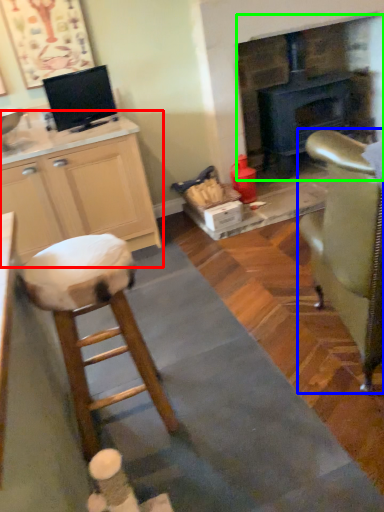
Question: Which is farther away from cabinetry (highlighted by a red box)? chair (highlighted by a blue box) or fireplace (highlighted by a green box)?

Choices:
 (A) chair
 (B) fireplace

Answer: (B)